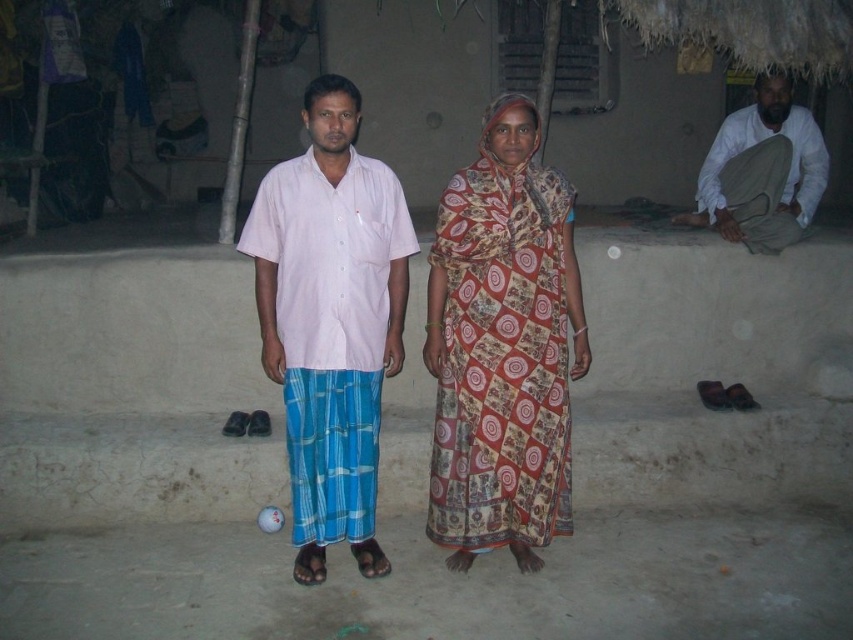
Question: Based on their relative distances, which object is farther from the light pink cotton shirt at center?

Choices:
 (A) white cotton shirt at right
 (B) printed cotton sari at center

Answer: (A)

Question: Which of these objects is positioned closest to the printed cotton sari at center?

Choices:
 (A) white cotton shirt at right
 (B) light pink cotton shirt at center

Answer: (B)

Question: Is light pink cotton shirt at center behind white cotton shirt at right?

Choices:
 (A) yes
 (B) no

Answer: (B)

Question: In this image, where is light pink cotton shirt at center located relative to white cotton shirt at right?

Choices:
 (A) left
 (B) right

Answer: (A)

Question: Can you confirm if printed cotton sari at center is positioned above white cotton shirt at right?

Choices:
 (A) no
 (B) yes

Answer: (A)

Question: Among these points, which one is nearest to the camera?

Choices:
 (A) [459, 461]
 (B) [786, 93]
 (C) [398, 326]

Answer: (A)